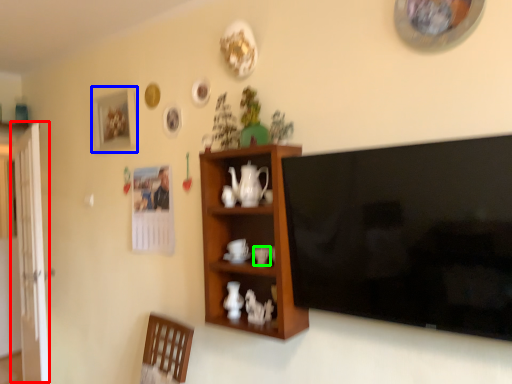
Question: Which is farther away from glass door (highlighted by a red box)? picture frame (highlighted by a blue box) or coffee cup (highlighted by a green box)?

Choices:
 (A) picture frame
 (B) coffee cup

Answer: (B)